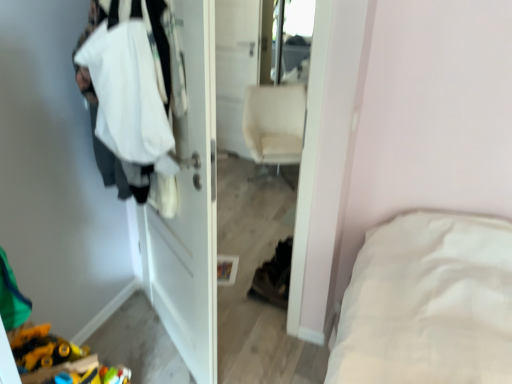
Question: Is white matte door at center in front of or behind white fabric at left in the image?

Choices:
 (A) front
 (B) behind

Answer: (B)

Question: Based on their positions, is white matte door at center located to the left or right of white fabric at left?

Choices:
 (A) right
 (B) left

Answer: (A)

Question: Considering the real-world distances, which object is closest to the glossy plastic mirror at upper center?

Choices:
 (A) white fabric at left
 (B) beige fabric chair at center
 (C) white matte door at center

Answer: (B)

Question: Which of these objects is positioned closest to the beige fabric chair at center?

Choices:
 (A) white matte door at center
 (B) white fabric at left
 (C) glossy plastic mirror at upper center

Answer: (C)